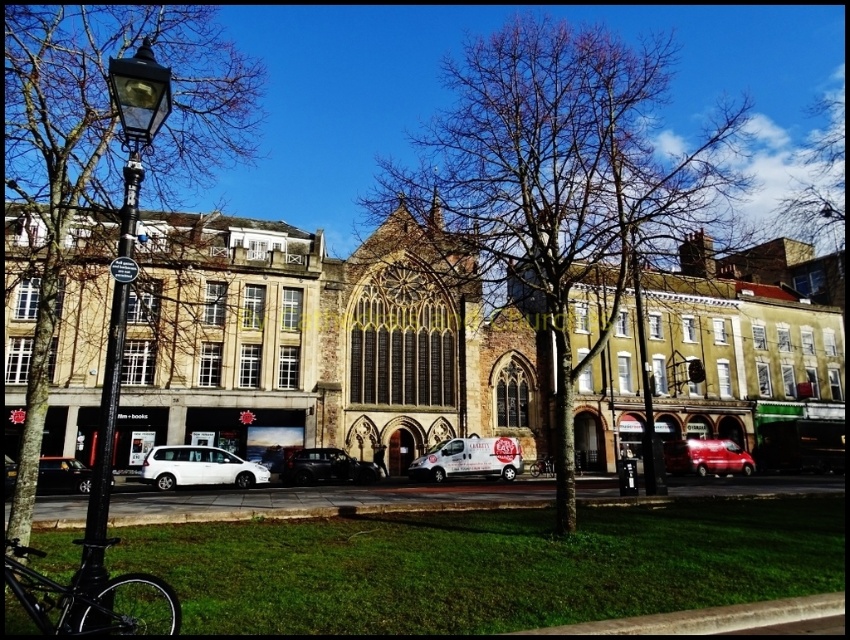
Can you confirm if bare branches at center is smaller than black metal lamp post at left?

No.

Measure the distance from bare branches at center to black metal lamp post at left.

bare branches at center and black metal lamp post at left are 202.89 feet apart from each other.

Between point (523, 301) and point (153, 579), which one is positioned behind?

Point (523, 301)

At what (x,y) coordinates should I click in order to perform the action: click on bare branches at center. Please return your answer as a coordinate pair (x, y). This screenshot has width=850, height=640. Looking at the image, I should click on (564, 186).

Measure the distance from brown stone church at center to brown leafless tree at left.

brown stone church at center is 94.30 feet away from brown leafless tree at left.

Who is lower down, brown stone church at center or brown leafless tree at left?

brown stone church at center is lower down.

At what (x,y) coordinates should I click in order to perform the action: click on brown stone church at center. Please return your answer as a coordinate pair (x, y). Image resolution: width=850 pixels, height=640 pixels. Looking at the image, I should click on (318, 342).

Which is above, green grass at lower center or white glossy van at center?

white glossy van at center

Can you confirm if green grass at lower center is bigger than white glossy van at center?

Indeed, green grass at lower center has a larger size compared to white glossy van at center.

What do you see at coordinates (488, 564) in the screenshot? The height and width of the screenshot is (640, 850). I see `green grass at lower center` at bounding box center [488, 564].

Identify the location of green grass at lower center. (488, 564).